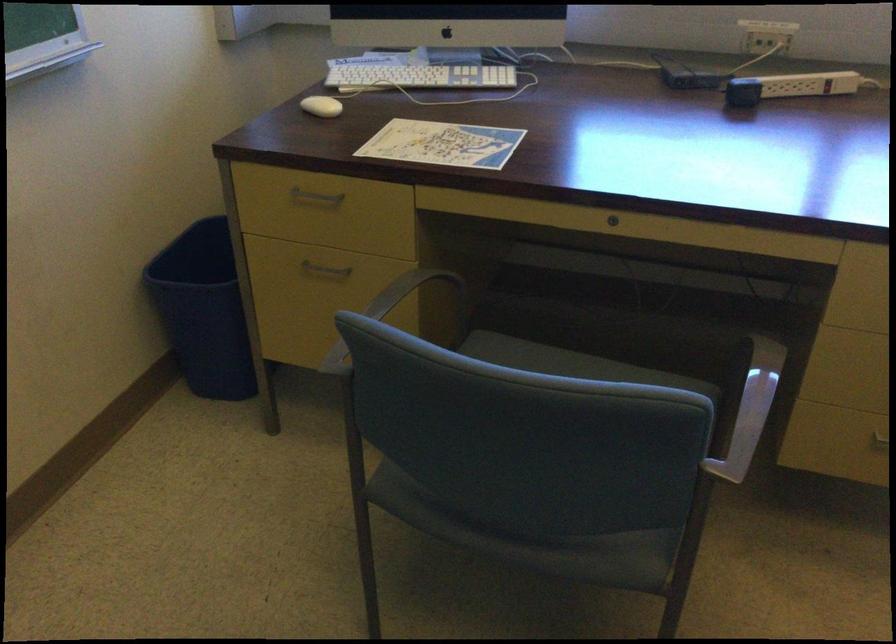
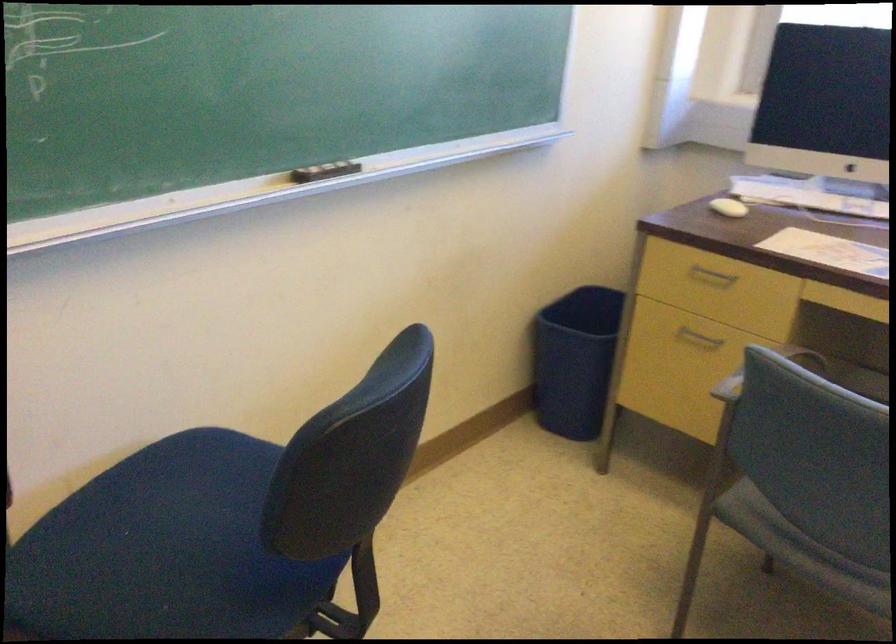
Find the pixel in the second image that matches (311,205) in the first image.

(711, 277)